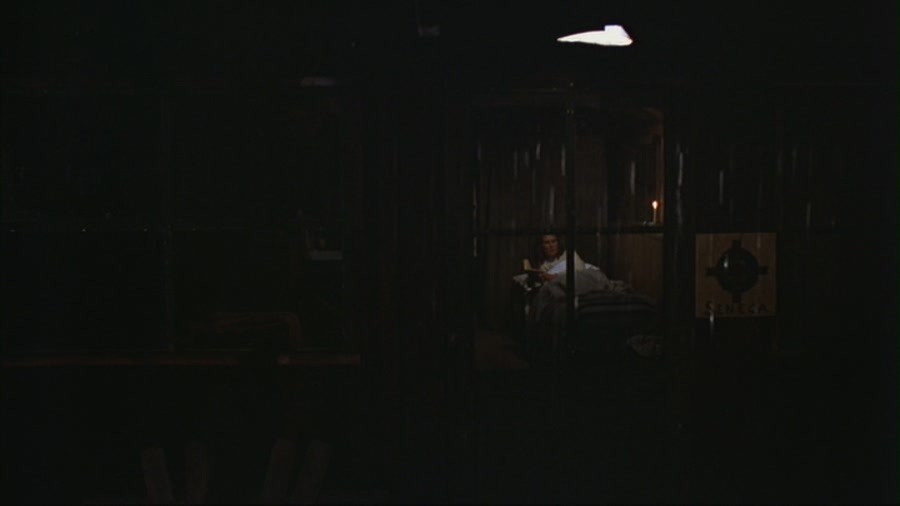
Locate an element on the screen. The width and height of the screenshot is (900, 506). bed is located at coordinates (599, 314).